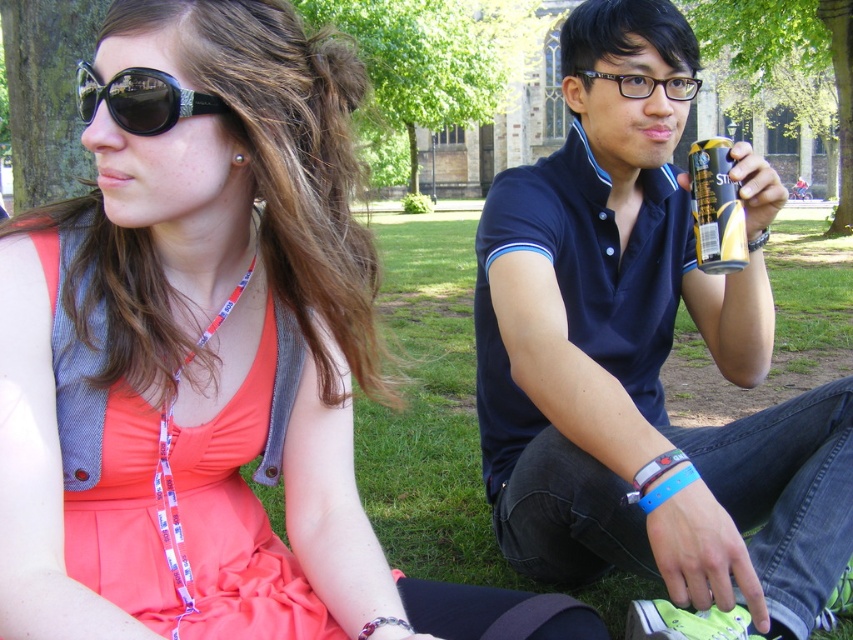
Question: Is matte black sunglasses at upper left wider than black shiny sunglasses at upper left?

Choices:
 (A) yes
 (B) no

Answer: (A)

Question: Which point is farther to the camera?

Choices:
 (A) (224, 497)
 (B) (711, 221)
 (C) (113, 104)

Answer: (B)

Question: Which of these objects is positioned farthest from the blue fabric polo shirt at center?

Choices:
 (A) black matte can at upper right
 (B) matte black sunglasses at upper left
 (C) black shiny sunglasses at upper left

Answer: (C)

Question: Is blue fabric polo shirt at center positioned behind black shiny sunglasses at upper left?

Choices:
 (A) yes
 (B) no

Answer: (A)

Question: Can you confirm if black shiny sunglasses at upper left is smaller than black matte can at upper right?

Choices:
 (A) yes
 (B) no

Answer: (B)

Question: Which point appears farthest from the camera in this image?

Choices:
 (A) (221, 426)
 (B) (730, 193)
 (C) (178, 92)
 (D) (488, 212)

Answer: (D)